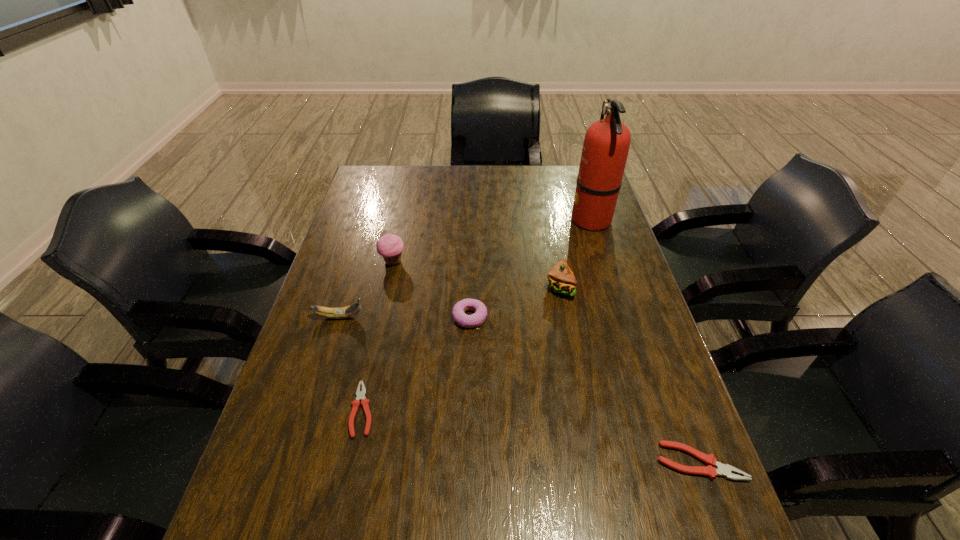
Where is `free space at the left edge of the desktop`? This screenshot has width=960, height=540. free space at the left edge of the desktop is located at coordinates (341, 320).

You are a GUI agent. You are given a task and a screenshot of the screen. Output one action in this format:
    pyautogui.click(x=<x>, y=<y>)
    Task: Click on the vacant region at the right edge of the desktop
    
    Given the screenshot: What is the action you would take?
    pyautogui.click(x=565, y=217)

You are a GUI agent. You are given a task and a screenshot of the screen. Output one action in this format:
    pyautogui.click(x=<x>, y=<y>)
    Task: Click on the vacant space at the far left corner
    The width and height of the screenshot is (960, 540).
    Given the screenshot: What is the action you would take?
    pyautogui.click(x=389, y=185)

The image size is (960, 540). Identify the location of free point at the far right corner. point(555,166).

I want to click on vacant space that is in between the shortest object and the sandwich, so click(461, 348).

I want to click on vacant area that lies between the nearer pliers and the fourth object from right to left, so click(585, 389).

Locate an element on the screen. free point between the fourth shortest object and the sandwich is located at coordinates (449, 302).

Identify the location of vacant area that lies between the banana and the fifth tallest object. The height and width of the screenshot is (540, 960). (404, 317).

What are the coordinates of `blank region between the fifth tallest object and the fire extinguisher` in the screenshot? It's located at (530, 268).

Locate an element on the screen. empty space between the farthest object and the cupcake is located at coordinates (492, 240).